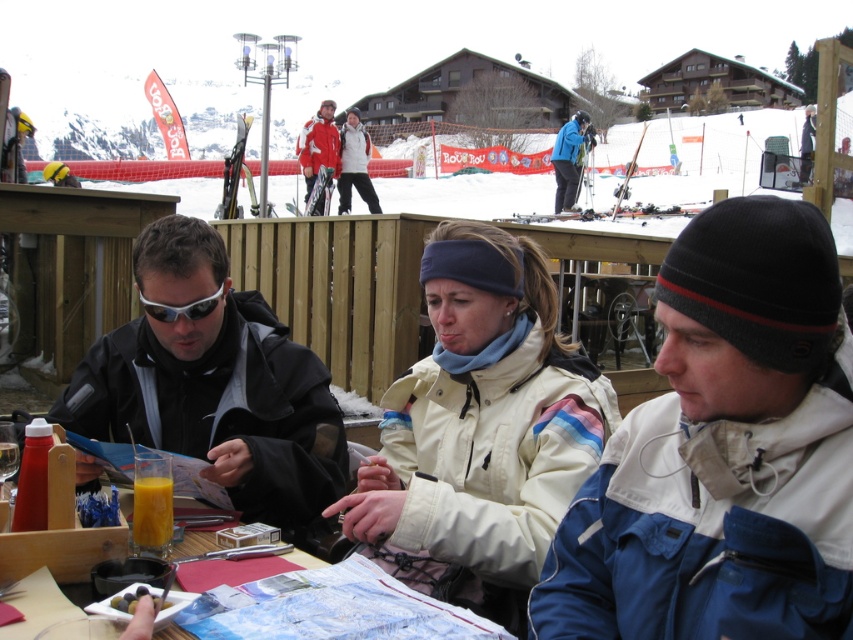
Question: Does white softshell jacket at center appear on the right side of matte black goggles at center?

Choices:
 (A) yes
 (B) no

Answer: (A)

Question: Among these objects, which one is nearest to the camera?

Choices:
 (A) blue/white jacket at center
 (B) black matte jacket at left
 (C) orange translucent glass at lower left
 (D) white softshell jacket at center

Answer: (A)

Question: Observing the image, what is the correct spatial positioning of matte red jacket at upper center in reference to matte black goggles at center?

Choices:
 (A) below
 (B) above

Answer: (B)

Question: Which point is farther to the camera?

Choices:
 (A) (184, 308)
 (B) (582, 544)
 (C) (566, 204)

Answer: (C)

Question: Based on their relative distances, which object is farther from the white softshell jacket at center?

Choices:
 (A) orange translucent glass at lower left
 (B) matte black goggles at center
 (C) matte red jacket at upper center
 (D) blue matte jacket at center

Answer: (D)

Question: Is white softshell jacket at center smaller than orange translucent glass at lower left?

Choices:
 (A) no
 (B) yes

Answer: (A)